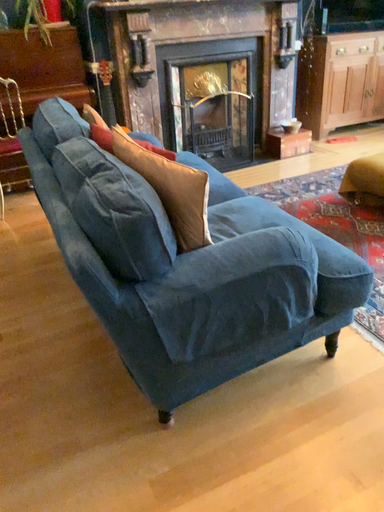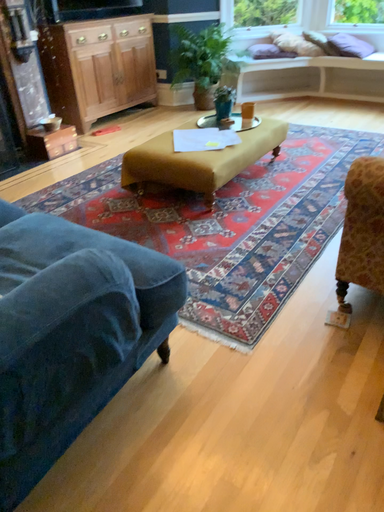
Question: How did the camera likely rotate when shooting the video?

Choices:
 (A) rotated right
 (B) rotated left

Answer: (A)